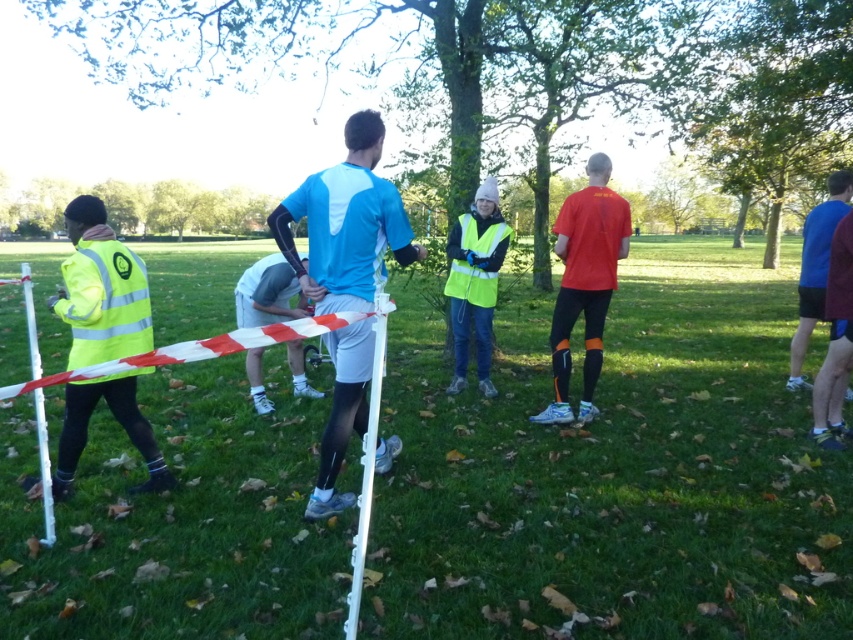
Question: Does neon yellow vest at center lie behind white/red striped tape at center?

Choices:
 (A) no
 (B) yes

Answer: (B)

Question: Is blue matte shirt at center positioned in front of neon yellow reflective safety vest at left?

Choices:
 (A) yes
 (B) no

Answer: (B)

Question: Observing the image, what is the correct spatial positioning of neon yellow vest at center in reference to white/red striped tape at center?

Choices:
 (A) right
 (B) left

Answer: (A)

Question: Estimate the real-world distances between objects in this image. Which object is closer to the high-visibility yellow jacket at left?

Choices:
 (A) white/red striped tape at center
 (B) blue fabric shirt at right

Answer: (A)

Question: Which object is positioned closest to the white plastic pole at center?

Choices:
 (A) blue matte shirt at center
 (B) white/red striped tape at center
 (C) green grass at center
 (D) light gray fabric shorts at center

Answer: (A)

Question: Which of the following is the farthest from the observer?

Choices:
 (A) high-visibility yellow jacket at left
 (B) matte orange shirt at center
 (C) white plastic pole at center
 (D) white plastic pole at lower left

Answer: (B)